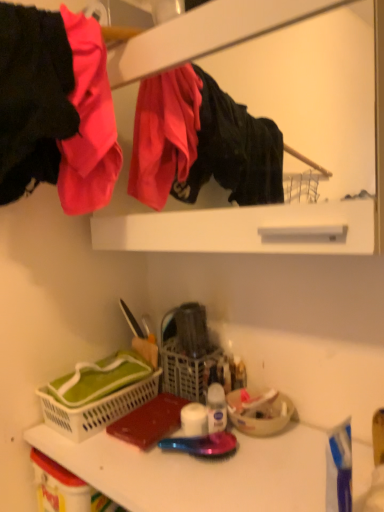
Locate an element on the screen. The image size is (384, 512). unoccupied region to the right of transparent plastic spray bottle at center is located at coordinates (291, 451).